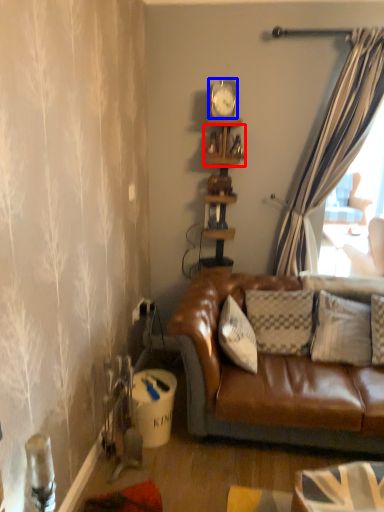
Question: Which object appears closest to the camera in this image, shelf (highlighted by a red box) or clock (highlighted by a blue box)?

Choices:
 (A) shelf
 (B) clock

Answer: (B)